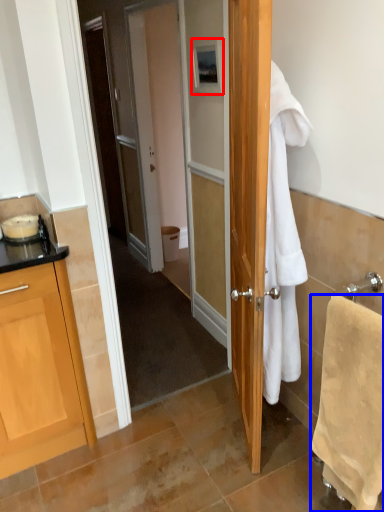
Question: Among these objects, which one is farthest to the camera, picture frame (highlighted by a red box) or towel/napkin (highlighted by a blue box)?

Choices:
 (A) picture frame
 (B) towel/napkin

Answer: (A)